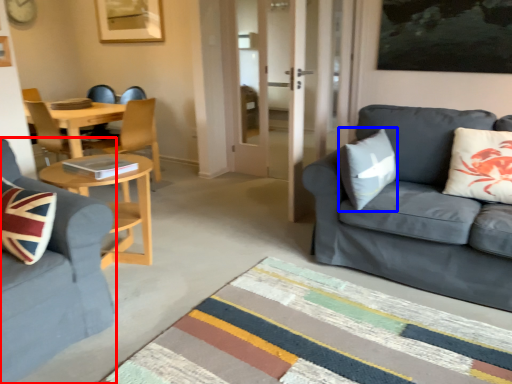
Question: Among these objects, which one is nearest to the camera, studio couch (highlighted by a red box) or pillow (highlighted by a blue box)?

Choices:
 (A) studio couch
 (B) pillow

Answer: (A)